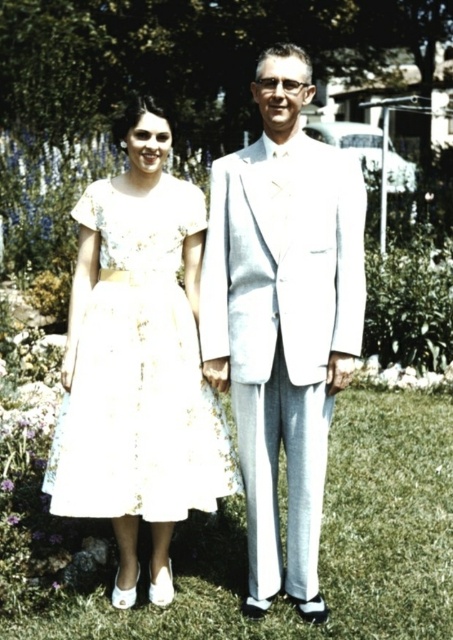
Question: Which point is closer to the camera taking this photo?

Choices:
 (A) (312, 616)
 (B) (144, 433)

Answer: (B)

Question: From the image, what is the correct spatial relationship of light gray suit at center in relation to white lace dress at center?

Choices:
 (A) below
 (B) above

Answer: (B)

Question: Is light gray suit at center below white lace dress at center?

Choices:
 (A) yes
 (B) no

Answer: (B)

Question: Can you confirm if light gray suit at center is wider than white lace dress at center?

Choices:
 (A) no
 (B) yes

Answer: (A)